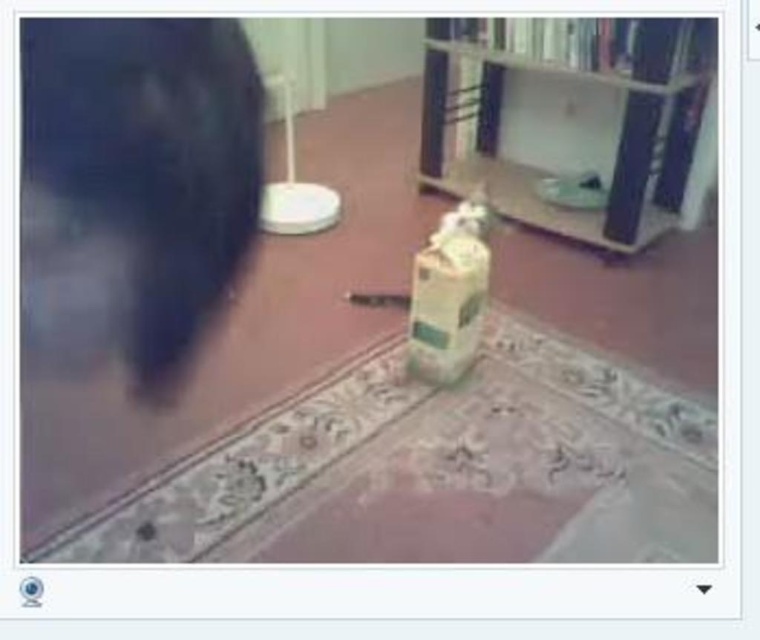
You are standing in a room with a security camera view. You see a white glossy bookshelf at upper center. Where exactly is the bookshelf located in the image?

The white glossy bookshelf at upper center is located at point 0.189 on the x axis and 0.757 on the y axis.

You are organizing items in a room and see the white glossy bookshelf at upper center and the matte plastic bottle at center. Which object is located above the other?

The white glossy bookshelf at upper center is positioned over the matte plastic bottle at center, so it is above the bottle.